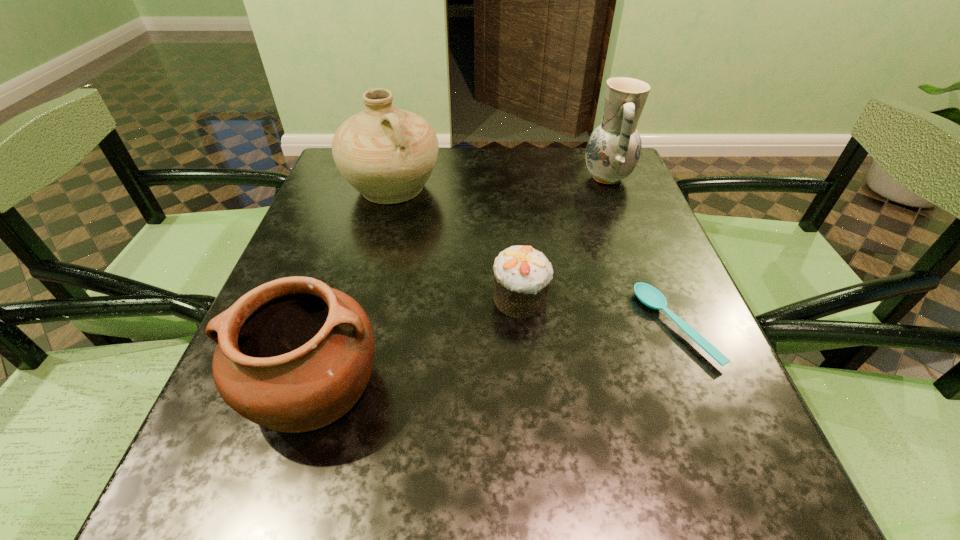
What are the coordinates of `vacant point located 0.270m on the front of the fourth tallest object` in the screenshot? It's located at (536, 470).

Where is `vacant space located 0.170m on the back of the shortest object`? vacant space located 0.170m on the back of the shortest object is located at coordinates (637, 234).

Find the location of `pottery that is positioned at the right edge`. pottery that is positioned at the right edge is located at coordinates (613, 150).

In order to click on spoon positioned at the right edge in this screenshot , I will do `click(648, 295)`.

The height and width of the screenshot is (540, 960). What are the coordinates of `object that is at the far left corner` in the screenshot? It's located at (387, 154).

I want to click on object that is at the far right corner, so click(x=613, y=150).

In the image, there is a desktop. Identify the location of vacant space at the far edge. (554, 170).

Image resolution: width=960 pixels, height=540 pixels. What are the coordinates of `free space at the near edge` in the screenshot? It's located at pyautogui.click(x=585, y=477).

The height and width of the screenshot is (540, 960). I want to click on vacant space at the left edge of the desktop, so click(363, 218).

The width and height of the screenshot is (960, 540). Identify the location of vacant space at the right edge of the desktop. (692, 327).